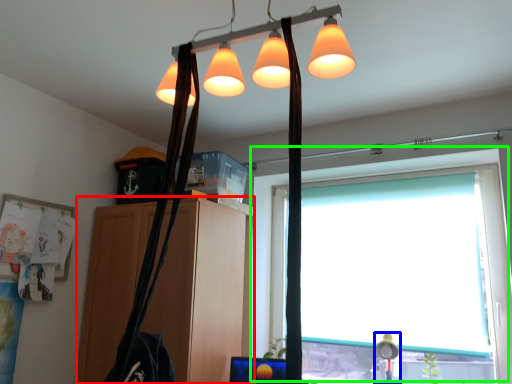
Question: Which object is positioned closest to cabinetry (highlighted by a red box)? Select from table lamp (highlighted by a blue box) and window (highlighted by a green box).

Choices:
 (A) table lamp
 (B) window

Answer: (B)